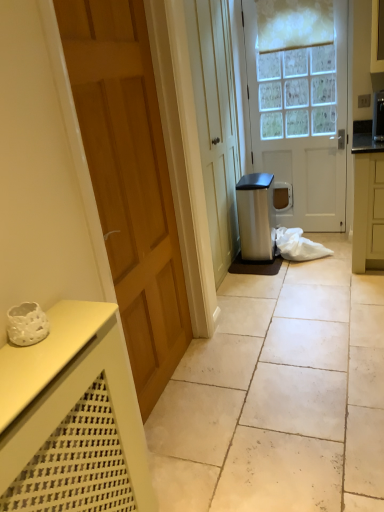
Question: Would you say wooden door at left, which appears as the 1th door when viewed from the front, is outside white glossy door at center, which appears as the 2th door when viewed from the left?

Choices:
 (A) no
 (B) yes

Answer: (B)

Question: From the image's perspective, is wooden door at left, which ranks as the 1th door in left-to-right order, under white glossy door at center, which is the second door from front to back?

Choices:
 (A) no
 (B) yes

Answer: (B)

Question: Is white glossy door at center, the first door positioned from the right, a part of wooden door at left, which is the second door in back-to-front order?

Choices:
 (A) no
 (B) yes

Answer: (A)

Question: Is wooden door at left, which is the second door in back-to-front order, at the left side of white glossy door at center, the first door positioned from the right?

Choices:
 (A) no
 (B) yes

Answer: (B)

Question: Would you consider wooden door at left, which is the second door in back-to-front order, to be distant from white glossy door at center, which is the second door from front to back?

Choices:
 (A) no
 (B) yes

Answer: (B)

Question: Can you confirm if wooden door at left, the 2th door in the right-to-left sequence, is bigger than white glossy door at center, which appears as the 2th door when viewed from the left?

Choices:
 (A) no
 (B) yes

Answer: (B)

Question: Is white tile floor at center wider than white glossy door at center, the first door positioned from the right?

Choices:
 (A) no
 (B) yes

Answer: (B)

Question: From a real-world perspective, is white tile floor at center over white glossy door at center, which is the second door from front to back?

Choices:
 (A) no
 (B) yes

Answer: (A)

Question: Would you say white glossy door at center, positioned as the 1th door in back-to-front order, is part of white tile floor at center's contents?

Choices:
 (A) yes
 (B) no

Answer: (B)

Question: Considering the relative sizes of white tile floor at center and white glossy door at center, the first door positioned from the right, in the image provided, is white tile floor at center smaller than white glossy door at center, the first door positioned from the right,?

Choices:
 (A) yes
 (B) no

Answer: (A)

Question: Is white tile floor at center at the left side of white glossy door at center, positioned as the 1th door in back-to-front order?

Choices:
 (A) no
 (B) yes

Answer: (B)

Question: Is white tile floor at center completely or partially outside of white glossy door at center, the first door positioned from the right?

Choices:
 (A) yes
 (B) no

Answer: (A)

Question: From the image's perspective, is white tile floor at center over wooden door at left, which is the second door in back-to-front order?

Choices:
 (A) yes
 (B) no

Answer: (B)